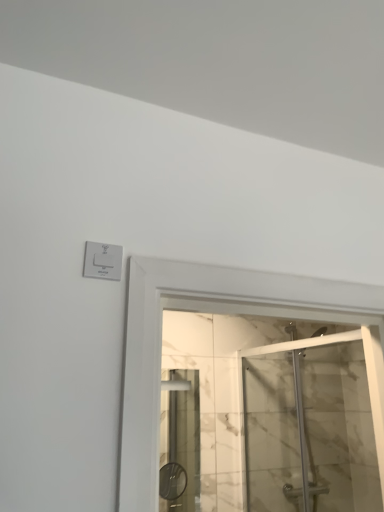
The width and height of the screenshot is (384, 512). What do you see at coordinates (310, 430) in the screenshot?
I see `transparent glass shower door at center` at bounding box center [310, 430].

This screenshot has width=384, height=512. I want to click on transparent glass shower door at center, so click(310, 430).

Describe the element at coordinates (102, 261) in the screenshot. I see `white plastic switch at upper left` at that location.

This screenshot has height=512, width=384. Find the location of `white plastic switch at upper left`. white plastic switch at upper left is located at coordinates (102, 261).

Identify the location of transparent glass shower door at center. (310, 430).

Considering the positions of objects white plastic switch at upper left and transparent glass shower door at center in the image provided, who is more to the right, white plastic switch at upper left or transparent glass shower door at center?

From the viewer's perspective, transparent glass shower door at center appears more on the right side.

Does white plastic switch at upper left lie behind transparent glass shower door at center?

No, white plastic switch at upper left is closer to the viewer.

Does point (100, 267) come farther from viewer compared to point (341, 501)?

No.

From the image's perspective, relative to transparent glass shower door at center, is white plastic switch at upper left above or below?

white plastic switch at upper left is situated higher than transparent glass shower door at center in the image.

From a real-world perspective, is white plastic switch at upper left physically above transparent glass shower door at center?

Yes, from a real-world perspective, white plastic switch at upper left is over transparent glass shower door at center

In terms of width, does white plastic switch at upper left look wider or thinner when compared to transparent glass shower door at center?

Considering their sizes, white plastic switch at upper left looks slimmer than transparent glass shower door at center.

Considering the sizes of white plastic switch at upper left and transparent glass shower door at center in the image, is white plastic switch at upper left taller or shorter than transparent glass shower door at center?

Clearly, white plastic switch at upper left is shorter compared to transparent glass shower door at center.

Looking at the image, does white plastic switch at upper left seem bigger or smaller compared to transparent glass shower door at center?

In the image, white plastic switch at upper left appears to be smaller than transparent glass shower door at center.

Is transparent glass shower door at center inside white plastic switch at upper left?

No.

Is white plastic switch at upper left not close to transparent glass shower door at center?

white plastic switch at upper left is far away from transparent glass shower door at center.

Could you tell me if white plastic switch at upper left is facing transparent glass shower door at center?

No, white plastic switch at upper left is not facing towards transparent glass shower door at center.

Can you tell me how much white plastic switch at upper left and transparent glass shower door at center differ in facing direction?

The angular difference between white plastic switch at upper left and transparent glass shower door at center is 95.7 degrees.

Measure the distance between white plastic switch at upper left and transparent glass shower door at center.

white plastic switch at upper left is 2.07 meters from transparent glass shower door at center.

This screenshot has height=512, width=384. In order to click on electric outlet above the transparent glass shower door at center (from a real-world perspective) in this screenshot , I will do `click(102, 261)`.

Which is more to the right, transparent glass shower door at center or white plastic switch at upper left?

transparent glass shower door at center is more to the right.

Which is in front, transparent glass shower door at center or white plastic switch at upper left?

white plastic switch at upper left is closer to the camera.

Considering the positions of point (345, 417) and point (112, 256), is point (345, 417) closer or farther from the camera than point (112, 256)?

Clearly, point (345, 417) is more distant from the camera than point (112, 256).

From the image's perspective, who appears lower, transparent glass shower door at center or white plastic switch at upper left?

transparent glass shower door at center is shown below in the image.

From a real-world perspective, is transparent glass shower door at center physically above white plastic switch at upper left?

No.

Considering the sizes of transparent glass shower door at center and white plastic switch at upper left in the image, is transparent glass shower door at center wider or thinner than white plastic switch at upper left?

transparent glass shower door at center is wider than white plastic switch at upper left.

Which of these two, transparent glass shower door at center or white plastic switch at upper left, stands taller?

With more height is transparent glass shower door at center.

Considering the sizes of objects transparent glass shower door at center and white plastic switch at upper left in the image provided, who is smaller, transparent glass shower door at center or white plastic switch at upper left?

white plastic switch at upper left is smaller.

Does transparent glass shower door at center contain white plastic switch at upper left?

Definitely not — white plastic switch at upper left is not inside transparent glass shower door at center.

Is transparent glass shower door at center not near white plastic switch at upper left?

Yes, transparent glass shower door at center is far from white plastic switch at upper left.

Does transparent glass shower door at center turn towards white plastic switch at upper left?

No, transparent glass shower door at center is not aimed at white plastic switch at upper left.

In order to click on electric outlet above the transparent glass shower door at center (from the image's perspective) in this screenshot , I will do `click(102, 261)`.

Locate an element on the screen. The image size is (384, 512). screen door on the right of white plastic switch at upper left is located at coordinates (310, 430).

Identify the location of screen door that is behind the white plastic switch at upper left. (310, 430).